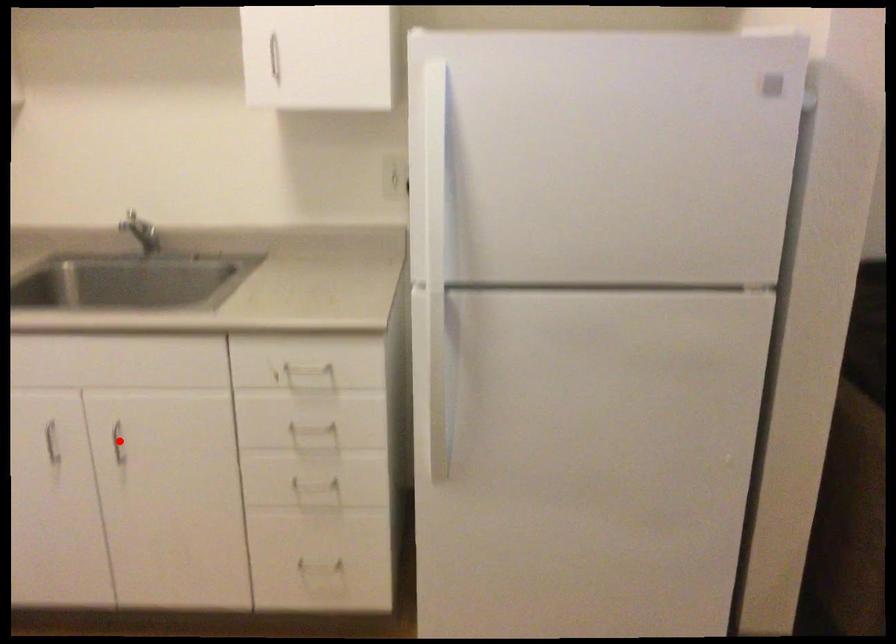
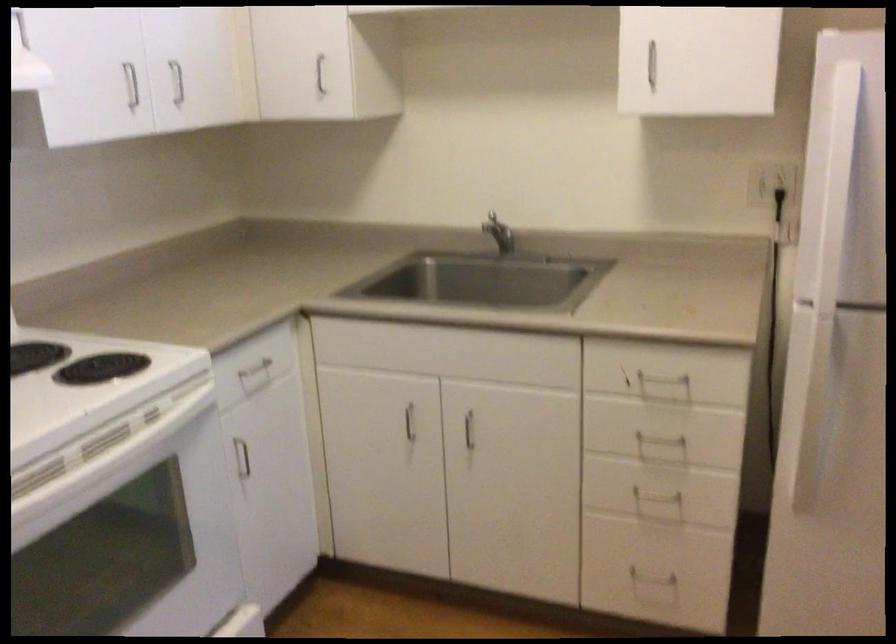
The point at the highlighted location is marked in the first image. Where is the corresponding point in the second image?

(469, 430)